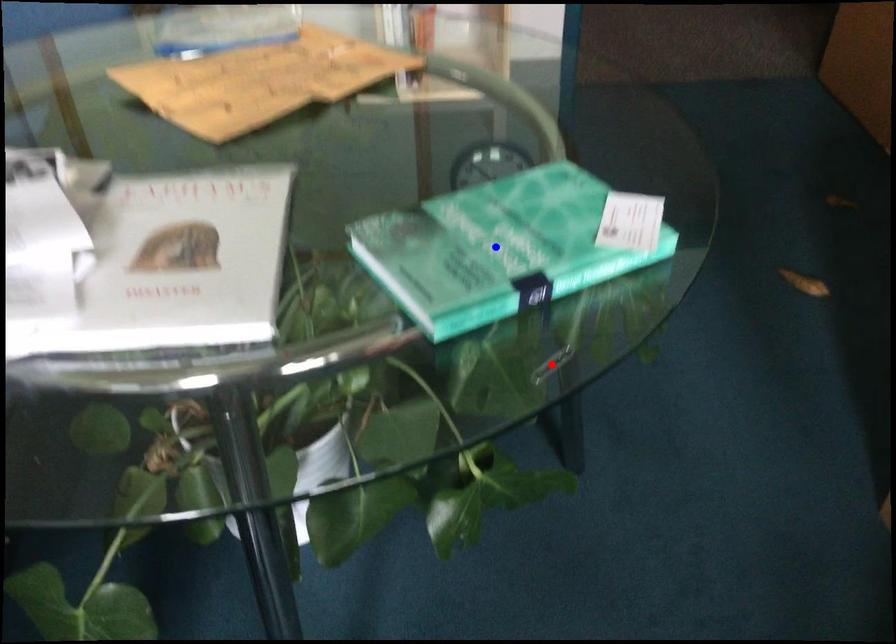
Question: In the image, two points are highlighted. Which point is nearer to the camera? Reply with the corresponding letter.

Choices:
 (A) blue point
 (B) red point

Answer: (A)